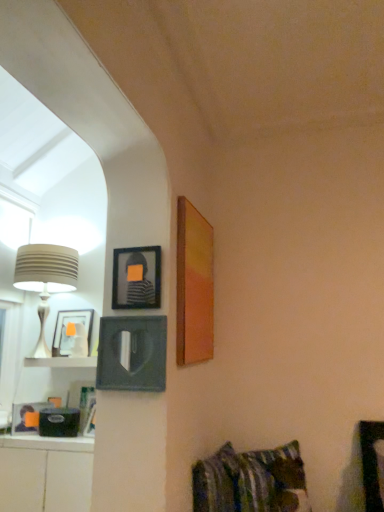
Question: Is matte black picture frame at left, which is the 1th picture frame from left to right, next to white glossy cabinet at lower left?

Choices:
 (A) no
 (B) yes

Answer: (A)

Question: From the image's perspective, is matte black picture frame at left, which is the 1th picture frame from left to right, on top of white glossy cabinet at lower left?

Choices:
 (A) yes
 (B) no

Answer: (A)

Question: Is white glossy cabinet at lower left located within matte black picture frame at left, which appears as the third picture frame when viewed from the right?

Choices:
 (A) yes
 (B) no

Answer: (B)

Question: From a real-world perspective, is matte black picture frame at left, which appears as the third picture frame when viewed from the right, over white glossy cabinet at lower left?

Choices:
 (A) yes
 (B) no

Answer: (A)

Question: Considering the relative sizes of matte black picture frame at left, which is the 1th picture frame from left to right, and white glossy cabinet at lower left in the image provided, is matte black picture frame at left, which is the 1th picture frame from left to right, bigger than white glossy cabinet at lower left?

Choices:
 (A) no
 (B) yes

Answer: (A)

Question: From their relative heights in the image, would you say striped fabric pillow at lower right is taller or shorter than white matte shelf at lower left?

Choices:
 (A) tall
 (B) short

Answer: (A)

Question: From a real-world perspective, is striped fabric pillow at lower right positioned above or below white matte shelf at lower left?

Choices:
 (A) above
 (B) below

Answer: (B)

Question: In terms of width, does striped fabric pillow at lower right look wider or thinner when compared to white matte shelf at lower left?

Choices:
 (A) thin
 (B) wide

Answer: (A)

Question: Is striped fabric pillow at lower right in front of or behind white matte shelf at lower left in the image?

Choices:
 (A) front
 (B) behind

Answer: (A)

Question: Is striped fabric pillow at lower right inside or outside of white matte shelf at lower left?

Choices:
 (A) outside
 (B) inside

Answer: (A)

Question: Looking at their shapes, would you say striped fabric pillow at lower right is wider or thinner than white matte shelf at lower left?

Choices:
 (A) thin
 (B) wide

Answer: (A)

Question: Considering their positions, is striped fabric pillow at lower right located in front of or behind white matte shelf at lower left?

Choices:
 (A) behind
 (B) front

Answer: (B)

Question: From a real-world perspective, relative to white matte shelf at lower left, is striped fabric pillow at lower right vertically above or below?

Choices:
 (A) above
 (B) below

Answer: (B)

Question: From a real-world perspective, relative to striped fabric pillow at lower right, is matte black picture frame at left, which is the 1th picture frame from left to right, vertically above or below?

Choices:
 (A) above
 (B) below

Answer: (A)

Question: Is matte black picture frame at left, which is the 1th picture frame from left to right, inside or outside of striped fabric pillow at lower right?

Choices:
 (A) outside
 (B) inside

Answer: (A)